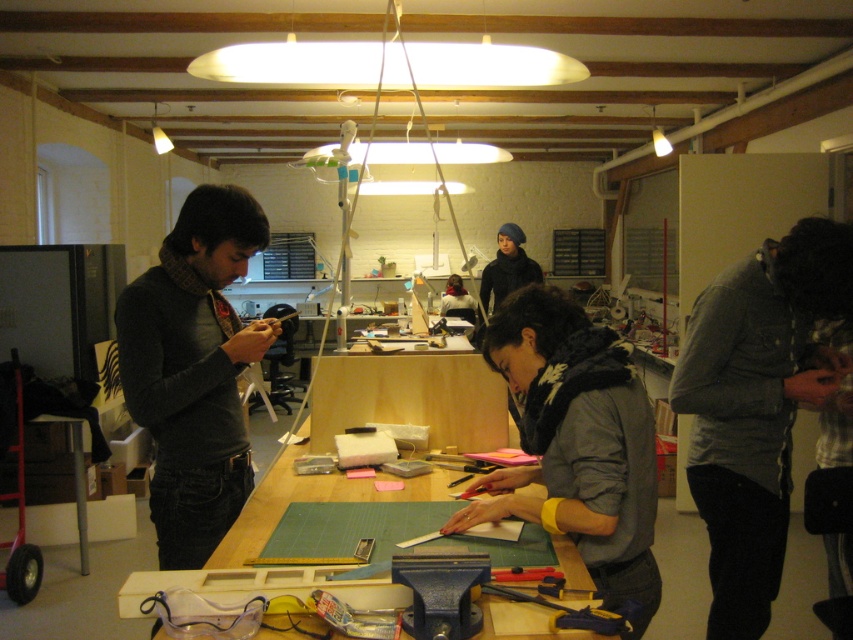
Between dark gray sweater at left and blue metal vise at lower center, which one has more height?

dark gray sweater at left

Who is more forward, (x=149, y=422) or (x=476, y=627)?

Positioned in front is point (x=476, y=627).

The width and height of the screenshot is (853, 640). Find the location of `dark gray sweater at left`. dark gray sweater at left is located at coordinates (194, 369).

Between gray textured jacket at lower right and green cutting mat at center, which one has less height?

With less height is green cutting mat at center.

Locate an element on the screen. Image resolution: width=853 pixels, height=640 pixels. gray textured jacket at lower right is located at coordinates (757, 404).

Is point (750, 378) positioned in front of point (425, 493)?

No, it is not.

Find the location of `gray textured jacket at lower right`. gray textured jacket at lower right is located at coordinates (757, 404).

Can you confirm if gray textured jacket at lower right is bigger than metallic silver screwdriver at lower center?

Correct, gray textured jacket at lower right is larger in size than metallic silver screwdriver at lower center.

Can you confirm if gray textured jacket at lower right is positioned to the left of metallic silver screwdriver at lower center?

No, gray textured jacket at lower right is not to the left of metallic silver screwdriver at lower center.

Is point (711, 499) in front of point (628, 609)?

No, (711, 499) is behind (628, 609).

In order to click on gray textured jacket at lower right in this screenshot , I will do `click(757, 404)`.